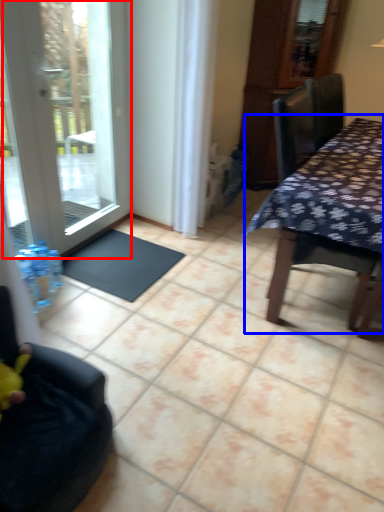
Question: Which object appears closest to the camera in this image, door (highlighted by a red box) or table (highlighted by a blue box)?

Choices:
 (A) door
 (B) table

Answer: (B)